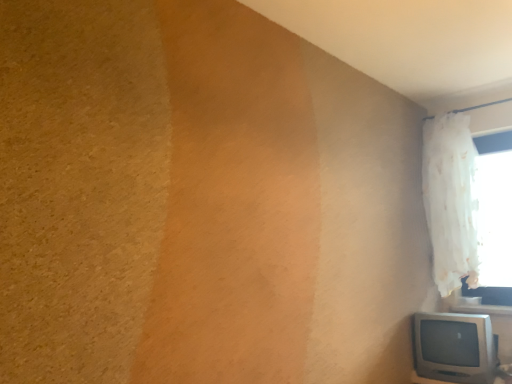
At what (x,y) coordinates should I click in order to perform the action: click on matte silver television at lower right. Please return your answer as a coordinate pair (x, y). Image resolution: width=512 pixels, height=384 pixels. Looking at the image, I should click on (454, 347).

Measure the distance between matte silver television at lower right and camera.

The depth of matte silver television at lower right is 2.22 meters.

What do you see at coordinates (454, 347) in the screenshot?
I see `matte silver television at lower right` at bounding box center [454, 347].

Locate an element on the screen. Image resolution: width=512 pixels, height=384 pixels. white sheer curtain at upper right is located at coordinates (469, 206).

What do you see at coordinates (469, 206) in the screenshot? The image size is (512, 384). I see `white sheer curtain at upper right` at bounding box center [469, 206].

Find the location of a particular element. matte silver television at lower right is located at coordinates click(x=454, y=347).

Which is more to the right, white sheer curtain at upper right or matte silver television at lower right?

Positioned to the right is white sheer curtain at upper right.

Is white sheer curtain at upper right closer to the viewer compared to matte silver television at lower right?

No, white sheer curtain at upper right is further to the viewer.

Is point (444, 278) positioned before point (435, 326)?

No, it is not.

From the image's perspective, which one is positioned lower, white sheer curtain at upper right or matte silver television at lower right?

matte silver television at lower right.

From a real-world perspective, which is physically above, white sheer curtain at upper right or matte silver television at lower right?

white sheer curtain at upper right is physically above.

Considering the sizes of objects white sheer curtain at upper right and matte silver television at lower right in the image provided, who is thinner, white sheer curtain at upper right or matte silver television at lower right?

Thinner between the two is white sheer curtain at upper right.

Who is shorter, white sheer curtain at upper right or matte silver television at lower right?

matte silver television at lower right is shorter.

Based on the photo, looking at the image, does white sheer curtain at upper right seem bigger or smaller compared to matte silver television at lower right?

In the image, white sheer curtain at upper right appears to be larger than matte silver television at lower right.

Is matte silver television at lower right completely or partially inside white sheer curtain at upper right?

No.

In the scene shown: Is white sheer curtain at upper right not near matte silver television at lower right?

No, white sheer curtain at upper right is in close proximity to matte silver television at lower right.

Based on the photo, is white sheer curtain at upper right facing away from matte silver television at lower right?

No, white sheer curtain at upper right is not facing the opposite direction of matte silver television at lower right.

How different are the orientations of white sheer curtain at upper right and matte silver television at lower right in degrees?

They differ by 2.14 degrees in their facing directions.

Image resolution: width=512 pixels, height=384 pixels. Identify the location of window above the matte silver television at lower right (from a real-world perspective). (469, 206).

Which is more to the right, matte silver television at lower right or white sheer curtain at upper right?

From the viewer's perspective, white sheer curtain at upper right appears more on the right side.

Which object is more forward, matte silver television at lower right or white sheer curtain at upper right?

Positioned in front is matte silver television at lower right.

Considering the positions of point (486, 342) and point (494, 210), is point (486, 342) closer or farther from the camera than point (494, 210)?

Clearly, point (486, 342) is closer to the camera than point (494, 210).

From the image's perspective, would you say matte silver television at lower right is positioned over white sheer curtain at upper right?

No, from the image's perspective, matte silver television at lower right is not above white sheer curtain at upper right.

From a real-world perspective, is matte silver television at lower right located beneath white sheer curtain at upper right?

Yes.

In the scene shown: Between matte silver television at lower right and white sheer curtain at upper right, which one has larger width?

matte silver television at lower right.

Can you confirm if matte silver television at lower right is taller than white sheer curtain at upper right?

Incorrect, the height of matte silver television at lower right is not larger of that of white sheer curtain at upper right.

Which of these two, matte silver television at lower right or white sheer curtain at upper right, is bigger?

white sheer curtain at upper right is bigger.

Is matte silver television at lower right outside of white sheer curtain at upper right?

matte silver television at lower right is positioned outside white sheer curtain at upper right.

Would you say matte silver television at lower right is a long distance from white sheer curtain at upper right?

No.

Is matte silver television at lower right facing towards white sheer curtain at upper right?

No, matte silver television at lower right is not turned towards white sheer curtain at upper right.

What's the angular difference between matte silver television at lower right and white sheer curtain at upper right's facing directions?

The angular difference between matte silver television at lower right and white sheer curtain at upper right is 2.14 degrees.

In order to click on television below the white sheer curtain at upper right (from the image's perspective) in this screenshot , I will do `click(454, 347)`.

Find the location of `window above the matte silver television at lower right (from the image's perspective)`. window above the matte silver television at lower right (from the image's perspective) is located at coordinates [x=469, y=206].

You are a GUI agent. You are given a task and a screenshot of the screen. Output one action in this format:
    pyautogui.click(x=<x>, y=<y>)
    Task: Click on the television in front of the white sheer curtain at upper right
    The image size is (512, 384).
    Given the screenshot: What is the action you would take?
    pyautogui.click(x=454, y=347)